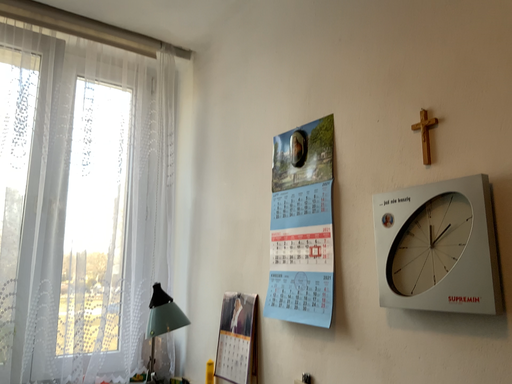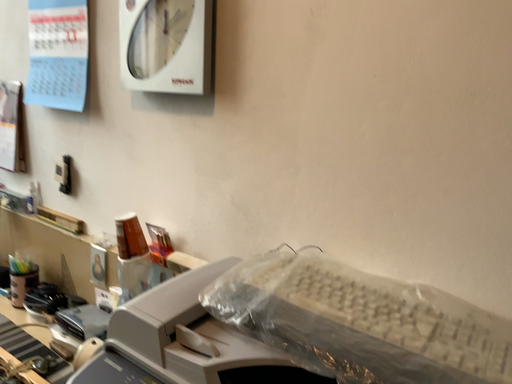
Question: Which way did the camera rotate in the video?

Choices:
 (A) rotated downward
 (B) rotated upward

Answer: (A)